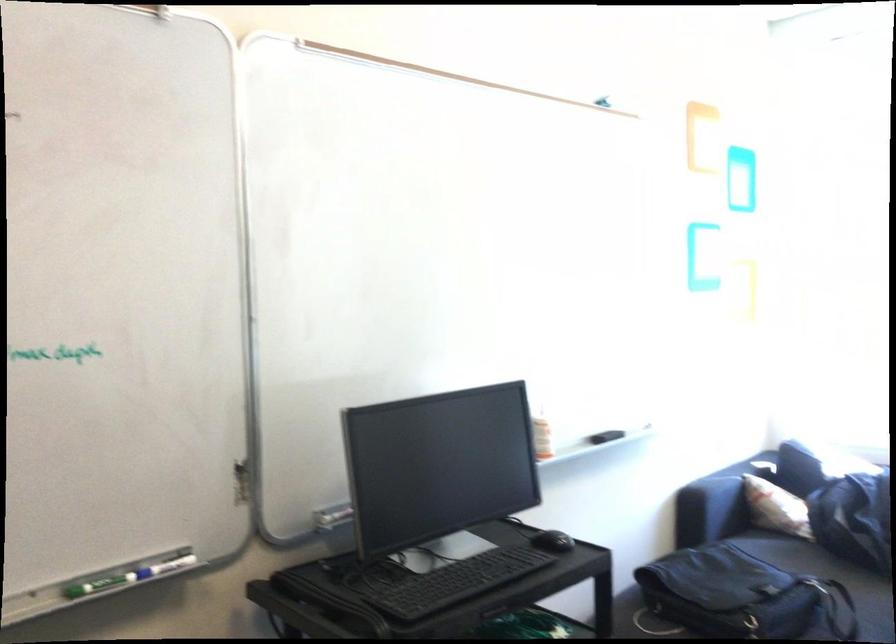
At what (x,y) coordinates should I click in order to perform the action: click on green dry-erase marker. Please return your answer as a coordinate pair (x, y). This screenshot has height=644, width=896. Looking at the image, I should click on pos(96,585).